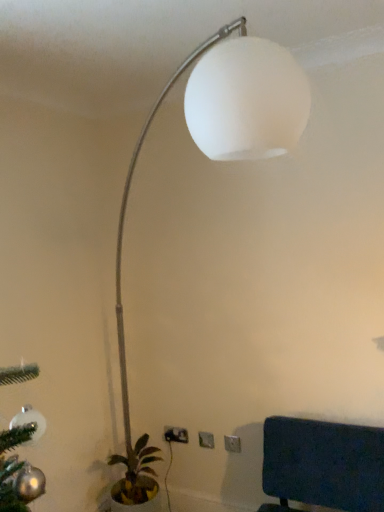
At what (x,y) coordinates should I click in order to perform the action: click on dark blue fabric at lower right. Please return your answer as a coordinate pair (x, y). Looking at the image, I should click on (322, 465).

The height and width of the screenshot is (512, 384). What do you see at coordinates (322, 465) in the screenshot?
I see `dark blue fabric at lower right` at bounding box center [322, 465].

The height and width of the screenshot is (512, 384). What do you see at coordinates (176, 435) in the screenshot?
I see `white plastic electric outlet at lower center, the 2th electric outlet positioned from the back` at bounding box center [176, 435].

Measure the distance between green leafy plant in pot at lower left and camera.

They are 7.08 feet apart.

Describe the element at coordinates (136, 479) in the screenshot. I see `green leafy plant in pot at lower left` at that location.

What are the coordinates of `white plastic electric outlet at lower center, the third electric outlet positioned from the left` in the screenshot? It's located at (232, 444).

Which object is further away from the camera, dark blue fabric at lower right or matte gray outlet at lower center, which appears as the 3th electric outlet when viewed from the right?

matte gray outlet at lower center, which appears as the 3th electric outlet when viewed from the right, is further away from the camera.

From the image's perspective, is dark blue fabric at lower right on matte gray outlet at lower center, which appears as the 3th electric outlet when viewed from the right?

Yes, from the image's perspective, dark blue fabric at lower right is above matte gray outlet at lower center, which appears as the 3th electric outlet when viewed from the right.

Is dark blue fabric at lower right wider than matte gray outlet at lower center, the first electric outlet from the left?

Correct, the width of dark blue fabric at lower right exceeds that of matte gray outlet at lower center, the first electric outlet from the left.

Can you confirm if dark blue fabric at lower right is smaller than matte gray outlet at lower center, the 1th electric outlet when ordered from back to front?

No, dark blue fabric at lower right is not smaller than matte gray outlet at lower center, the 1th electric outlet when ordered from back to front.

Considering the positions of objects white plastic electric outlet at lower center, placed as the second electric outlet when sorted from left to right, and white matte lamp at upper center in the image provided, who is more to the left, white plastic electric outlet at lower center, placed as the second electric outlet when sorted from left to right, or white matte lamp at upper center?

Positioned to the left is white matte lamp at upper center.

How many degrees apart are the facing directions of white plastic electric outlet at lower center, which is the 2th electric outlet in right-to-left order, and white matte lamp at upper center?

The angle between the facing direction of white plastic electric outlet at lower center, which is the 2th electric outlet in right-to-left order, and the facing direction of white matte lamp at upper center is 45.4 degrees.

Considering the positions of points (183, 439) and (126, 440), is point (183, 439) farther from camera compared to point (126, 440)?

No, (183, 439) is closer to viewer.

Is the depth of matte gray outlet at lower center, the 1th electric outlet when ordered from back to front, less than that of green leafy plant in pot at lower left?

No, matte gray outlet at lower center, the 1th electric outlet when ordered from back to front, is behind green leafy plant in pot at lower left.

From a real-world perspective, is matte gray outlet at lower center, the first electric outlet from the left, below green leafy plant in pot at lower left?

No, from a real-world perspective, matte gray outlet at lower center, the first electric outlet from the left, is not below green leafy plant in pot at lower left.

Image resolution: width=384 pixels, height=512 pixels. I want to click on electric outlet that is the 3rd object located behind the green leafy plant in pot at lower left, so 170,434.

Could you tell me if matte gray outlet at lower center, the 1th electric outlet when ordered from back to front, is turned towards green leafy plant in pot at lower left?

Yes, matte gray outlet at lower center, the 1th electric outlet when ordered from back to front, is oriented towards green leafy plant in pot at lower left.

Looking at this image, what's the angular difference between green leafy plant in pot at lower left and white plastic electric outlet at lower center, which is the 2th electric outlet in right-to-left order,'s facing directions?

They differ by 83.5 degrees in their facing directions.

Could white plastic electric outlet at lower center, the 2th electric outlet when ordered from front to back, be considered to be inside green leafy plant in pot at lower left?

→ Actually, white plastic electric outlet at lower center, the 2th electric outlet when ordered from front to back, is outside green leafy plant in pot at lower left.

Which of these two, green leafy plant in pot at lower left or white plastic electric outlet at lower center, the 2th electric outlet when ordered from front to back, is bigger?

green leafy plant in pot at lower left.

From the image's perspective, who appears lower, green leafy plant in pot at lower left or white plastic electric outlet at lower center, the 2th electric outlet positioned from the back?

green leafy plant in pot at lower left, from the image's perspective.

Considering the sizes of objects green leafy plant in pot at lower left and dark blue fabric at lower right in the image provided, who is shorter, green leafy plant in pot at lower left or dark blue fabric at lower right?

Standing shorter between the two is green leafy plant in pot at lower left.

Could you tell me if green leafy plant in pot at lower left is turned towards dark blue fabric at lower right?

Yes, green leafy plant in pot at lower left faces towards dark blue fabric at lower right.

Does green leafy plant in pot at lower left have a lesser width compared to dark blue fabric at lower right?

Yes.

Between white plastic electric outlet at lower center, the 2th electric outlet positioned from the back, and green leafy plant in pot at lower left, which one is positioned in front?

green leafy plant in pot at lower left.

Can you tell me how much white plastic electric outlet at lower center, placed as the second electric outlet when sorted from left to right, and green leafy plant in pot at lower left differ in facing direction?

They differ by 83.5 degrees in their facing directions.

From the picture: Is white plastic electric outlet at lower center, the 2th electric outlet positioned from the back, far away from green leafy plant in pot at lower left?

white plastic electric outlet at lower center, the 2th electric outlet positioned from the back, is actually quite close to green leafy plant in pot at lower left.

Can you confirm if white plastic electric outlet at lower center, the 2th electric outlet when ordered from front to back, is wider than green leafy plant in pot at lower left?

No, white plastic electric outlet at lower center, the 2th electric outlet when ordered from front to back, is not wider than green leafy plant in pot at lower left.

Is dark blue fabric at lower right shorter than white plastic electric outlet at lower center, which is counted as the 1th electric outlet, starting from the front?

Incorrect, the height of dark blue fabric at lower right does not fall short of that of white plastic electric outlet at lower center, which is counted as the 1th electric outlet, starting from the front.

Considering the relative sizes of dark blue fabric at lower right and white plastic electric outlet at lower center, which is the first electric outlet in right-to-left order, in the image provided, is dark blue fabric at lower right wider than white plastic electric outlet at lower center, which is the first electric outlet in right-to-left order,?

Indeed, dark blue fabric at lower right has a greater width compared to white plastic electric outlet at lower center, which is the first electric outlet in right-to-left order.

The image size is (384, 512). Find the location of `furniture on the right side of white plastic electric outlet at lower center, arranged as the third electric outlet when viewed from the back`. furniture on the right side of white plastic electric outlet at lower center, arranged as the third electric outlet when viewed from the back is located at coordinates (322, 465).

How much distance is there between dark blue fabric at lower right and white plastic electric outlet at lower center, which is counted as the 1th electric outlet, starting from the front?

dark blue fabric at lower right is 20.79 inches from white plastic electric outlet at lower center, which is counted as the 1th electric outlet, starting from the front.

What are the coordinates of `furniture in front of the matte gray outlet at lower center, which appears as the 3th electric outlet when viewed from the right` in the screenshot? It's located at (x=322, y=465).

The height and width of the screenshot is (512, 384). Find the location of `lamp that appears above the white plastic electric outlet at lower center, which is the 2th electric outlet in right-to-left order (from the image's perspective)`. lamp that appears above the white plastic electric outlet at lower center, which is the 2th electric outlet in right-to-left order (from the image's perspective) is located at coordinates (127, 201).

From the image, which object appears to be farther from dark blue fabric at lower right, white plastic electric outlet at lower center, which is the 2th electric outlet in right-to-left order, or white matte lamp at upper center?

The object further to dark blue fabric at lower right is white matte lamp at upper center.

Which object lies further to the anchor point green leafy plant in pot at lower left, white matte lamp at upper center or white plastic electric outlet at lower center, which is counted as the 1th electric outlet, starting from the front?

white matte lamp at upper center lies further to green leafy plant in pot at lower left than the other object.

Based on their spatial positions, is white matte lamp at upper center or white plastic electric outlet at lower center, which is the 2th electric outlet in right-to-left order, further from green leafy plant in pot at lower left?

white matte lamp at upper center lies further to green leafy plant in pot at lower left than the other object.

Considering their positions, is white plastic electric outlet at lower center, arranged as the third electric outlet when viewed from the back, positioned closer to matte gray outlet at lower center, which appears as the 3th electric outlet when viewed from the right, than white plastic electric outlet at lower center, the 2th electric outlet positioned from the back?

white plastic electric outlet at lower center, the 2th electric outlet positioned from the back, lies closer to matte gray outlet at lower center, which appears as the 3th electric outlet when viewed from the right, than the other object.

Estimate the real-world distances between objects in this image. Which object is further from green leafy plant in pot at lower left, white plastic electric outlet at lower center, which is the 2th electric outlet in right-to-left order, or white matte lamp at upper center?

The object further to green leafy plant in pot at lower left is white matte lamp at upper center.

Based on their spatial positions, is white plastic electric outlet at lower center, the 2th electric outlet when ordered from front to back, or matte gray outlet at lower center, the 1th electric outlet when ordered from back to front, closer to white matte lamp at upper center?

The object closer to white matte lamp at upper center is white plastic electric outlet at lower center, the 2th electric outlet when ordered from front to back.

From the picture: When comparing their distances from matte gray outlet at lower center, acting as the 3th electric outlet starting from the front, does white plastic electric outlet at lower center, placed as the second electric outlet when sorted from left to right, or white matte lamp at upper center seem further?

white matte lamp at upper center lies further to matte gray outlet at lower center, acting as the 3th electric outlet starting from the front, than the other object.

Which object lies nearer to the anchor point dark blue fabric at lower right, white plastic electric outlet at lower center, the 2th electric outlet positioned from the back, or green leafy plant in pot at lower left?

green leafy plant in pot at lower left.

This screenshot has height=512, width=384. Identify the location of furniture between white matte lamp at upper center and green leafy plant in pot at lower left from front to back. (322, 465).

What are the coordinates of `houseplant located between dark blue fabric at lower right and white plastic electric outlet at lower center, which is counted as the 1th electric outlet, starting from the front, in the depth direction` in the screenshot? It's located at (x=136, y=479).

The image size is (384, 512). Find the location of `electric outlet located between dark blue fabric at lower right and white plastic electric outlet at lower center, placed as the second electric outlet when sorted from left to right, in the depth direction`. electric outlet located between dark blue fabric at lower right and white plastic electric outlet at lower center, placed as the second electric outlet when sorted from left to right, in the depth direction is located at coordinates (232, 444).

The image size is (384, 512). Identify the location of furniture between white matte lamp at upper center and white plastic electric outlet at lower center, the 2th electric outlet positioned from the back, in the front-back direction. (322, 465).